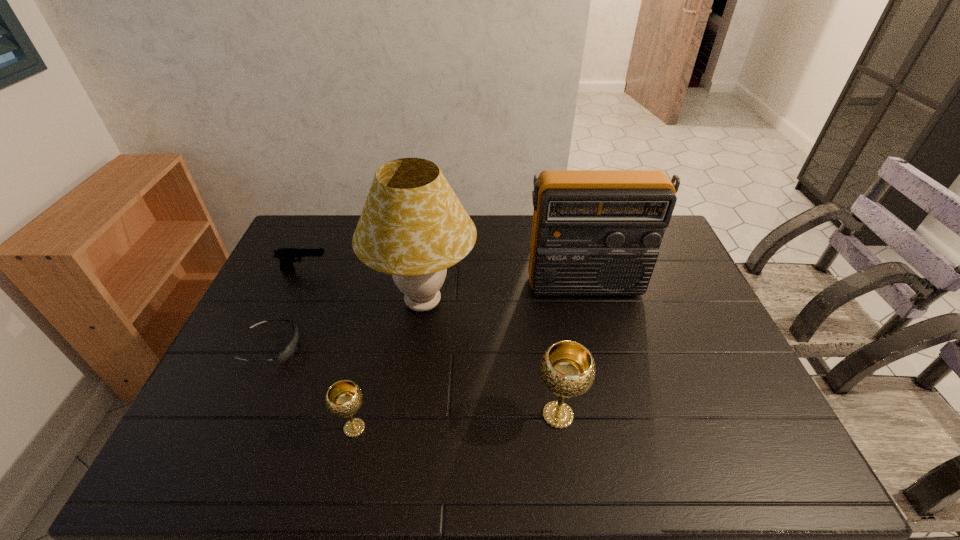
Identify the location of the left chalice. The height and width of the screenshot is (540, 960). (344, 398).

Locate an element on the screen. the shorter chalice is located at coordinates (344, 398).

Where is `the right chalice`? This screenshot has width=960, height=540. the right chalice is located at coordinates (567, 368).

Identify the location of the taller chalice. (567, 368).

Where is `pistol`? This screenshot has width=960, height=540. pistol is located at coordinates (287, 256).

Locate an element on the screen. radio receiver is located at coordinates (595, 232).

At what (x,y) coordinates should I click in order to perform the action: click on the shortest object. Please return your answer as a coordinate pair (x, y). Looking at the image, I should click on (288, 351).

What are the coordinates of `lampshade` in the screenshot? It's located at (413, 227).

The image size is (960, 540). In order to click on blank space located on the left of the third shortest object in this screenshot , I will do `click(208, 428)`.

The width and height of the screenshot is (960, 540). Identify the location of vacant space positioned 0.060m on the right of the right chalice. (607, 415).